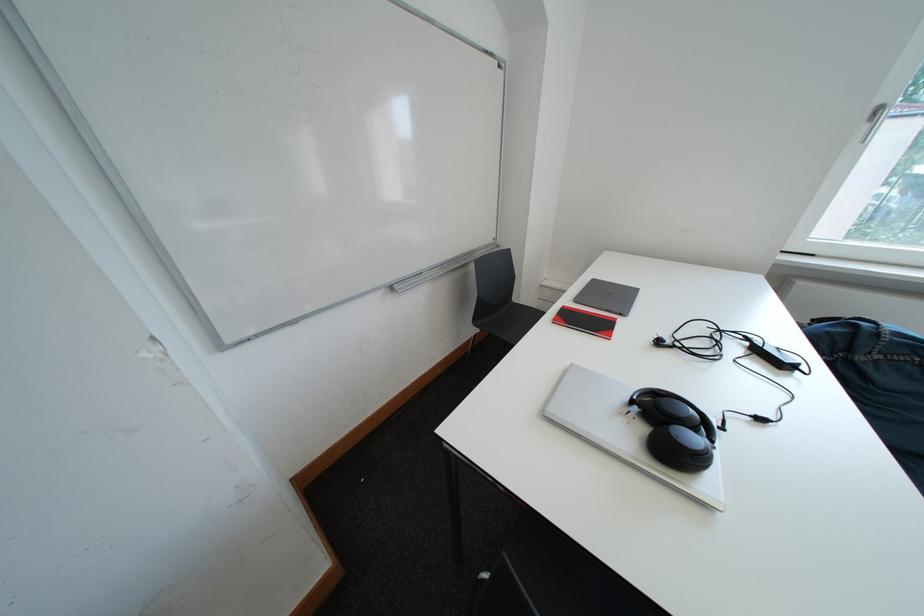
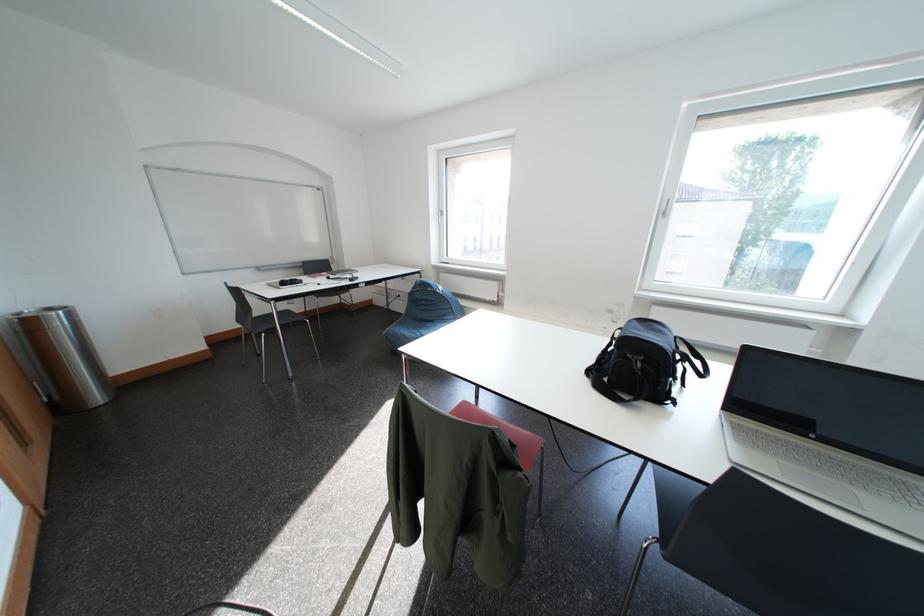
Question: I am providing you with two images of the same scene from different viewpoints. After the viewpoint changes to image2, which objects are now occluded?

Choices:
 (A) black bag
 (B) black headphones
 (C) red chair sitting surface
 (D) glass bell jar

Answer: (B)